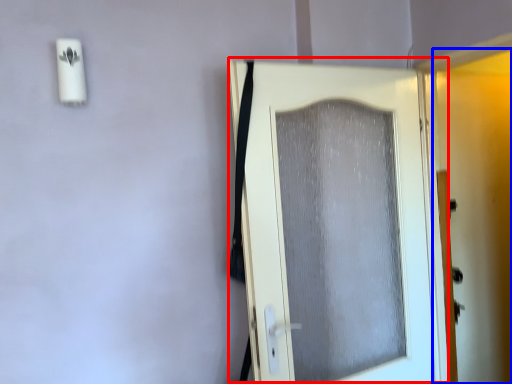
Question: Which object is further to the camera taking this photo, door (highlighted by a red box) or screen door (highlighted by a blue box)?

Choices:
 (A) door
 (B) screen door

Answer: (B)